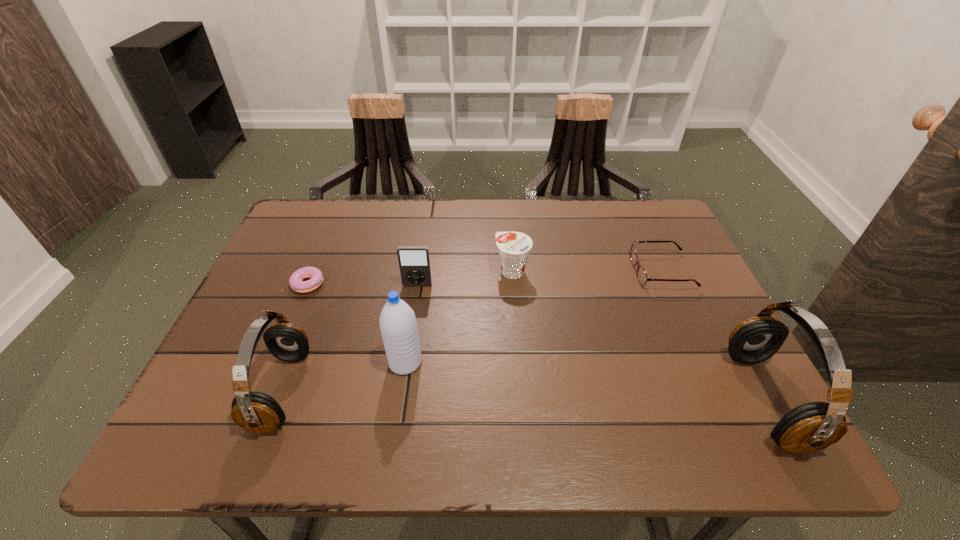
Where is `free space at the right edge of the desktop`? This screenshot has width=960, height=540. free space at the right edge of the desktop is located at coordinates (692, 361).

Identify the location of free spot at the near left corner of the desktop. The image size is (960, 540). (231, 372).

Image resolution: width=960 pixels, height=540 pixels. Find the location of `vacant position at the far right corner of the desktop`. vacant position at the far right corner of the desktop is located at coordinates (667, 227).

In the image, there is a desktop. What are the coordinates of `vacant space at the near right corner` in the screenshot? It's located at (737, 395).

Where is `vacant space that is in between the water bottle and the doughnut`? The height and width of the screenshot is (540, 960). vacant space that is in between the water bottle and the doughnut is located at coordinates (356, 323).

At what (x,y) coordinates should I click in order to perform the action: click on free space between the iPod and the shortest object. Please return your answer as a coordinate pair (x, y). Image resolution: width=960 pixels, height=540 pixels. Looking at the image, I should click on (362, 285).

Where is `free space between the taller headset and the fourth tallest object`? free space between the taller headset and the fourth tallest object is located at coordinates (591, 342).

I want to click on vacant area that lies between the water bottle and the right headset, so click(586, 381).

This screenshot has width=960, height=540. What are the coordinates of `empty space that is in between the yogurt and the right headset` in the screenshot? It's located at (639, 335).

I want to click on vacant region between the yogurt and the sixth tallest object, so (x=588, y=271).